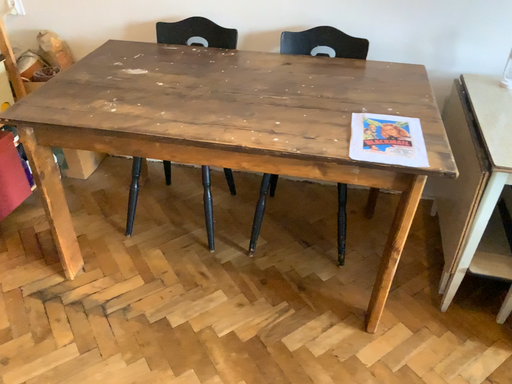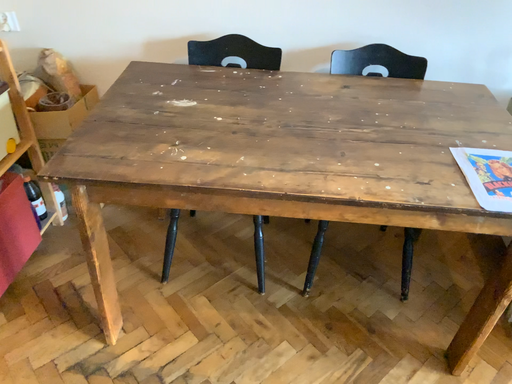
Question: Which way did the camera rotate in the video?

Choices:
 (A) rotated right
 (B) rotated left

Answer: (A)